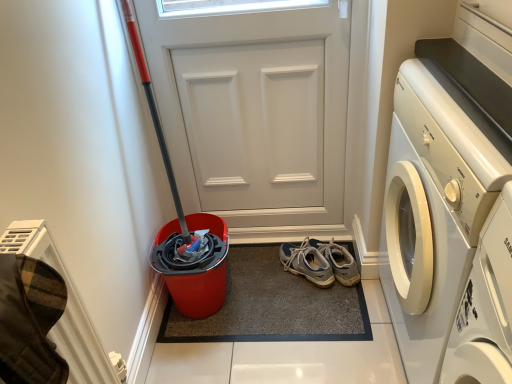
The width and height of the screenshot is (512, 384). In order to click on free spot below carpeted mat at center (from a real-world perspective) in this screenshot , I will do `click(273, 288)`.